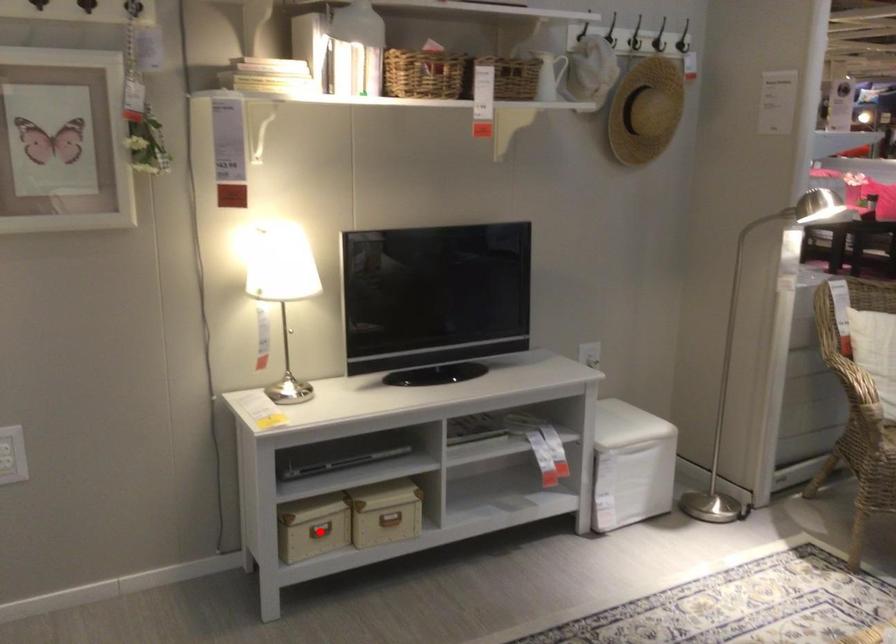
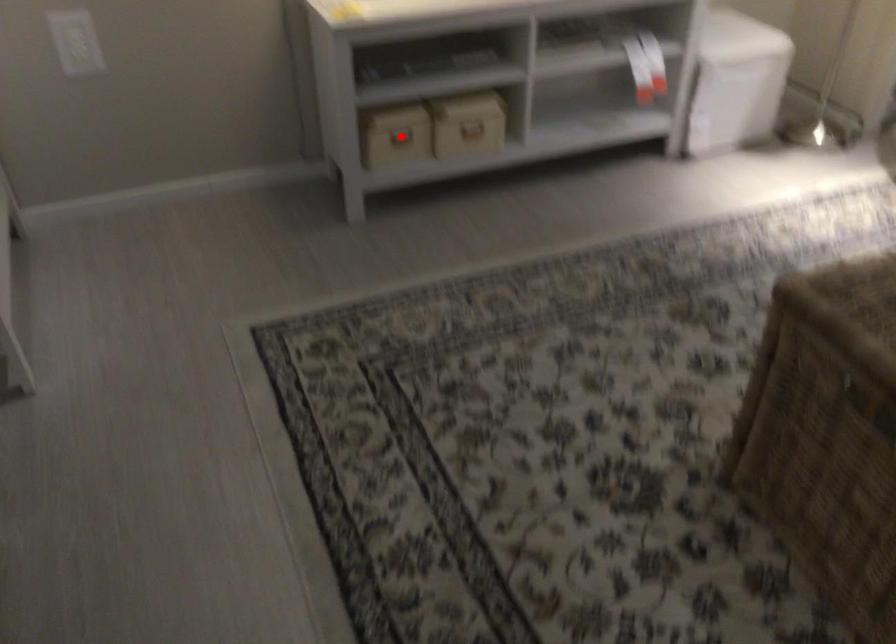
I am providing you with two images of the same scene from different viewpoints. A red point is marked on the first image and another point is marked on the second image. Is the marked point in image1 the same physical position as the marked point in image2?

Yes